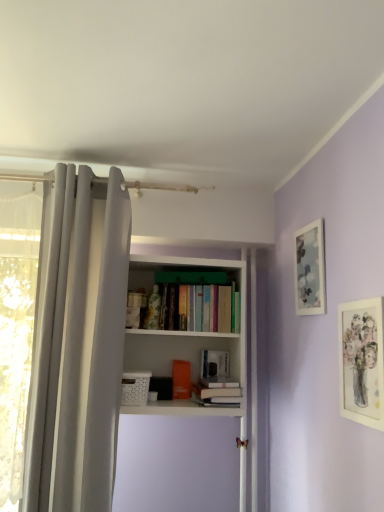
Question: Considering their positions, is white fabric curtain at left located in front of or behind white matte picture frame at upper right, which is counted as the first picture frame, starting from the front?

Choices:
 (A) front
 (B) behind

Answer: (B)

Question: Is white fabric curtain at left bigger or smaller than white matte picture frame at upper right, which is counted as the first picture frame, starting from the front?

Choices:
 (A) big
 (B) small

Answer: (A)

Question: Estimate the real-world distances between objects in this image. Which object is closer to the white matte book at center, the first book viewed from the back?

Choices:
 (A) white matte bookshelf at center
 (B) hardcover book at center, the first book viewed from the front
 (C) matte glass picture frame at upper right, arranged as the second picture frame when viewed from the front
 (D) white matte picture frame at upper right, which is counted as the first picture frame, starting from the front
 (E) white fabric curtain at left

Answer: (B)

Question: Considering the real-world distances, which object is closest to the white matte bookshelf at center?

Choices:
 (A) matte glass picture frame at upper right, arranged as the second picture frame when viewed from the front
 (B) white fabric curtain at left
 (C) white matte book at center, the first book viewed from the back
 (D) hardcover book at center, the first book viewed from the front
 (E) white matte picture frame at upper right, the second picture frame positioned from the back

Answer: (C)